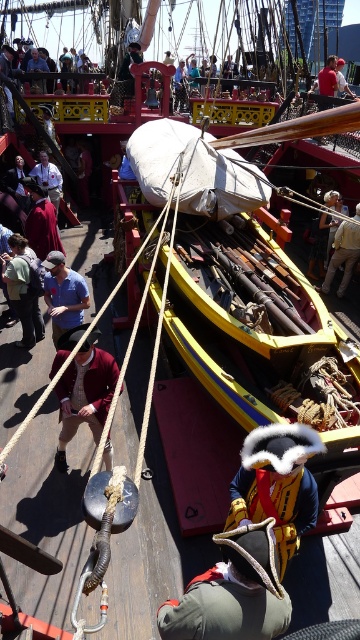
Question: Considering the real-world distances, which object is farthest from the matte blue shirt at center?

Choices:
 (A) green felt hat at center
 (B) maroon wool coat at lower left

Answer: (A)

Question: Does green felt hat at center appear on the right side of matte blue shirt at center?

Choices:
 (A) no
 (B) yes

Answer: (B)

Question: Is green felt hat at center wider than matte blue shirt at center?

Choices:
 (A) no
 (B) yes

Answer: (B)

Question: Among these points, which one is farthest from the camera?

Choices:
 (A) (263, 586)
 (B) (52, 276)
 (C) (77, 412)

Answer: (B)

Question: Can you confirm if green felt hat at center is wider than maroon wool coat at lower left?

Choices:
 (A) yes
 (B) no

Answer: (B)

Question: Which point is farther to the camera?

Choices:
 (A) (172, 627)
 (B) (86, 291)

Answer: (B)